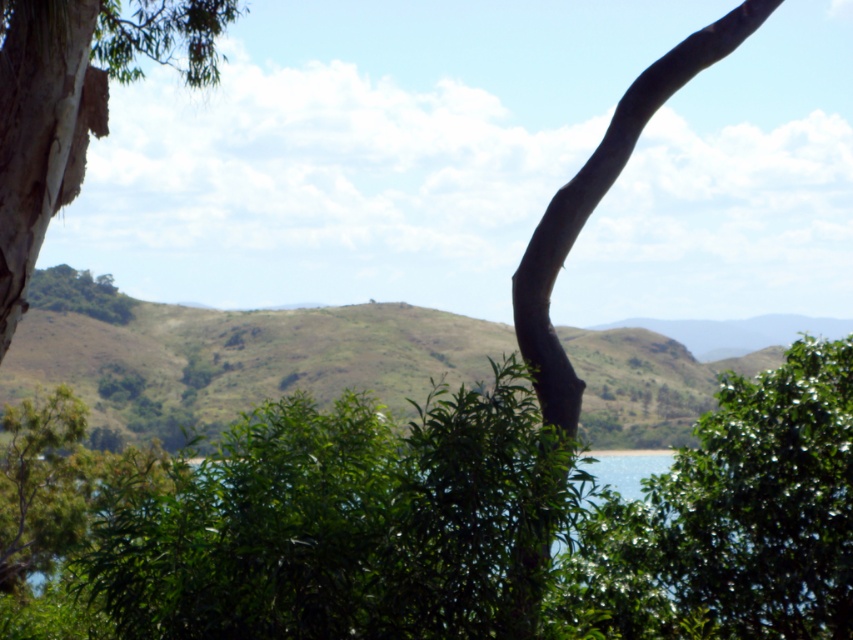
How distant is green leafy tree at center from brown rough bark tree at upper right?

6.10 feet

Does green leafy tree at center have a lesser width compared to brown rough bark tree at upper right?

In fact, green leafy tree at center might be wider than brown rough bark tree at upper right.

Locate an element on the screen. green leafy tree at center is located at coordinates (732, 520).